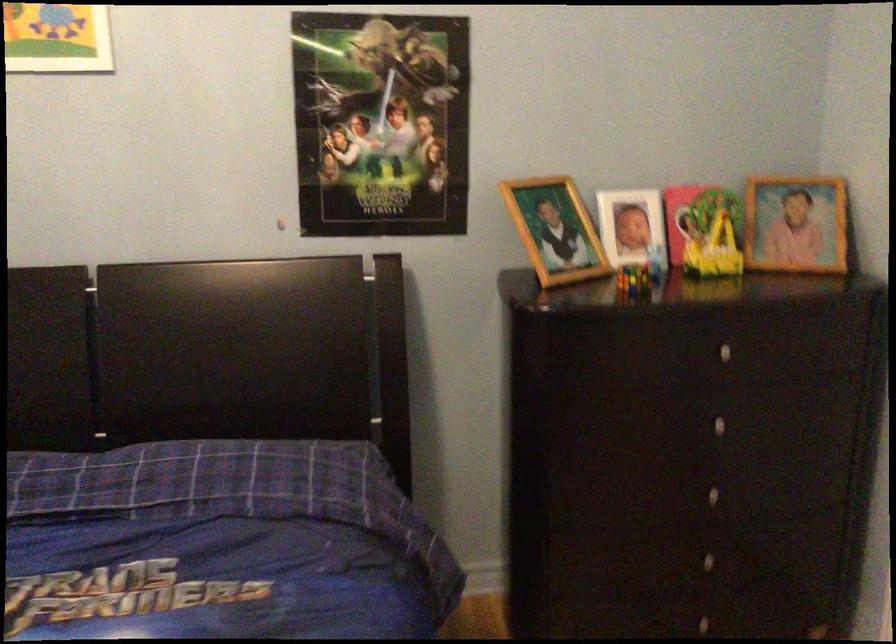
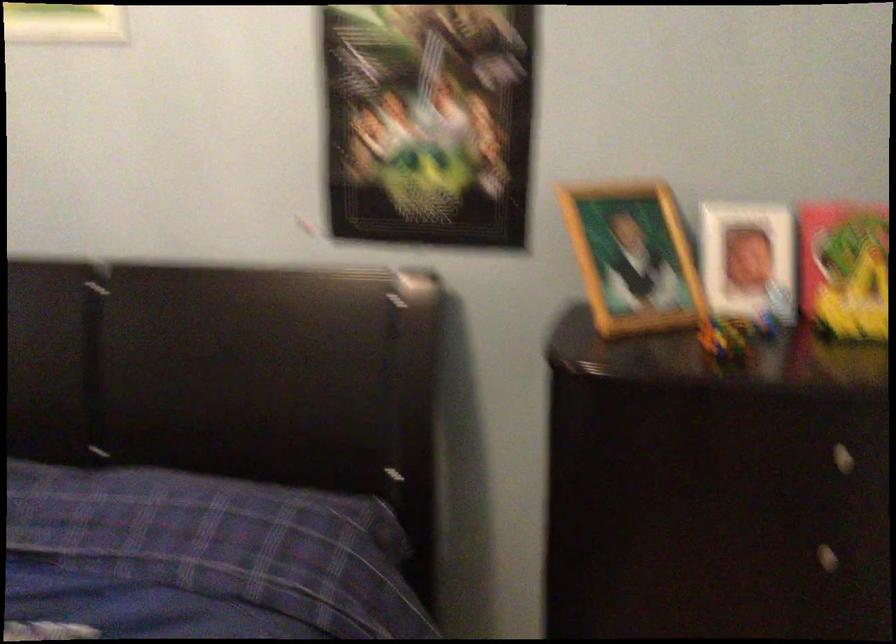
Question: The camera is either moving clockwise (left) or counter-clockwise (right) around the object. The first image is from the beginning of the video and the second image is from the end. Is the camera moving left or right when shooting the video?

Choices:
 (A) Left
 (B) Right

Answer: (B)